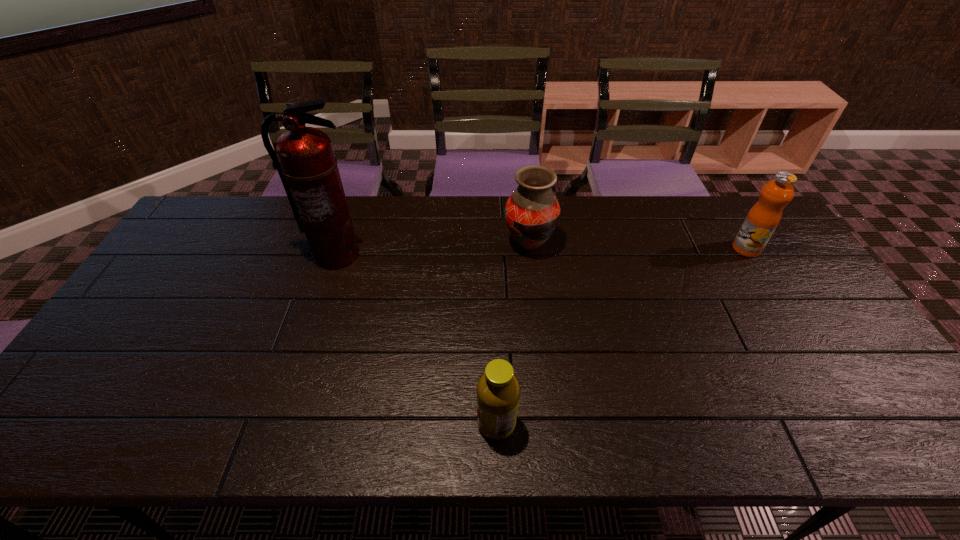
At what (x,y) coordinates should I click in order to perform the action: click on vacant region at the near edge. Please return your answer as a coordinate pair (x, y). This screenshot has height=540, width=960. Looking at the image, I should click on (432, 436).

The width and height of the screenshot is (960, 540). I want to click on vacant point at the left edge, so click(x=164, y=340).

You are a GUI agent. You are given a task and a screenshot of the screen. Output one action in this format:
    pyautogui.click(x=<x>, y=<y>)
    Task: Click on the blank space at the right edge of the desktop
    The width and height of the screenshot is (960, 540).
    Given the screenshot: What is the action you would take?
    pyautogui.click(x=848, y=330)

Find the location of `free space between the fire extinguisher and the taller fruit juice`. free space between the fire extinguisher and the taller fruit juice is located at coordinates (541, 252).

Image resolution: width=960 pixels, height=540 pixels. Identify the location of free space between the shortest object and the vase. (513, 334).

What are the coordinates of `empty space between the tallest object and the vase` in the screenshot? It's located at (432, 249).

At what (x,y) coordinates should I click in order to perform the action: click on free space between the right fruit juice and the vase. Please return your answer as a coordinate pair (x, y). The image size is (960, 540). Looking at the image, I should click on (637, 246).

What are the coordinates of `vacant space that's between the shortest object and the taller fruit juice` in the screenshot? It's located at (621, 336).

The image size is (960, 540). I want to click on vacant space that's between the vase and the nearest object, so click(513, 334).

Locate an element on the screen. free space between the nearer fruit juice and the farther fruit juice is located at coordinates (621, 336).